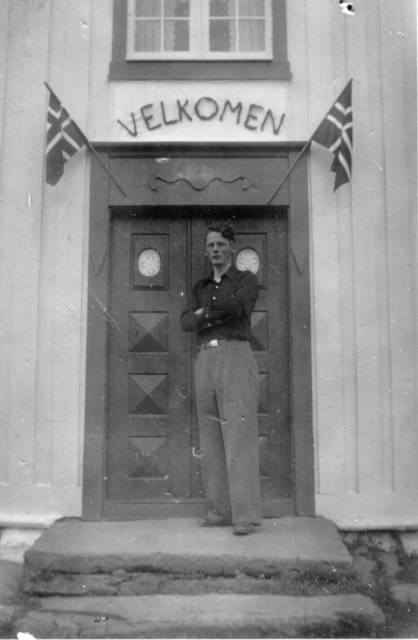
Does wooden door at center come behind white fabric flag at upper right?

No, wooden door at center is in front of white fabric flag at upper right.

Does wooden door at center have a smaller size compared to white fabric flag at upper right?

Incorrect, wooden door at center is not smaller in size than white fabric flag at upper right.

The image size is (418, 640). What do you see at coordinates (153, 356) in the screenshot?
I see `wooden door at center` at bounding box center [153, 356].

Locate an element on the screen. The image size is (418, 640). wooden door at center is located at coordinates (153, 356).

Does white fabric flag at upper right have a greater width compared to white fabric flag at upper left?

Correct, the width of white fabric flag at upper right exceeds that of white fabric flag at upper left.

Identify the location of white fabric flag at upper right. Image resolution: width=418 pixels, height=640 pixels. (x=338, y=134).

Who is shorter, smooth gray pants at center or white fabric flag at upper right?

With less height is white fabric flag at upper right.

Does smooth gray pants at center appear on the left side of white fabric flag at upper right?

Yes, smooth gray pants at center is to the left of white fabric flag at upper right.

Measure the distance between point (247, 376) and camera.

A distance of 5.53 meters exists between point (247, 376) and camera.

Where is `smooth gray pants at center`? The height and width of the screenshot is (640, 418). smooth gray pants at center is located at coordinates (226, 385).